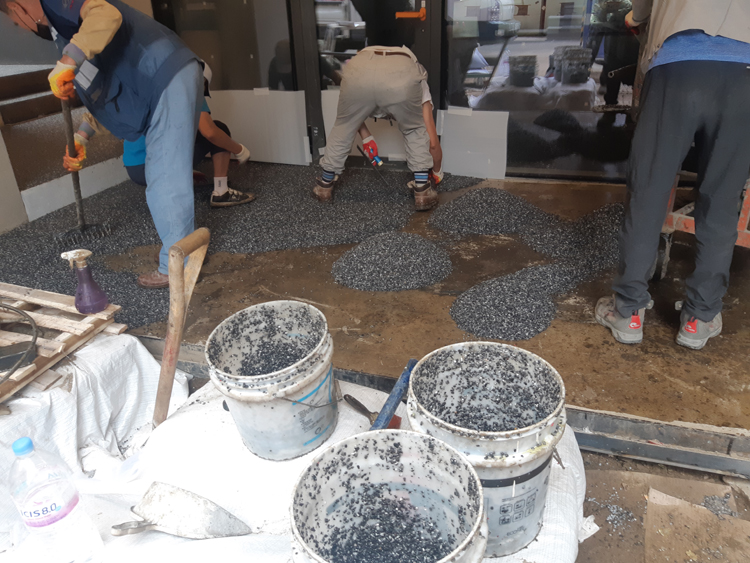
I want to click on window, so pyautogui.click(x=540, y=26).